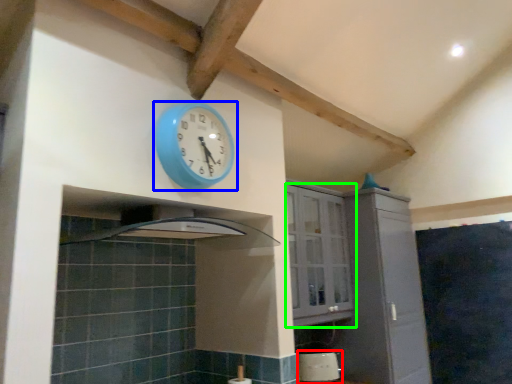
Question: Which is nearer to the appliance (highlighted by a red box)? wall clock (highlighted by a blue box) or cabinetry (highlighted by a green box).

Choices:
 (A) wall clock
 (B) cabinetry

Answer: (B)